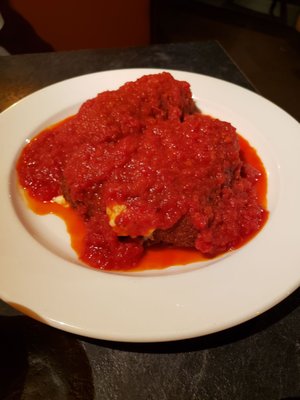
Locate an element on the screen. The height and width of the screenshot is (400, 300). baseboard is located at coordinates (257, 24).